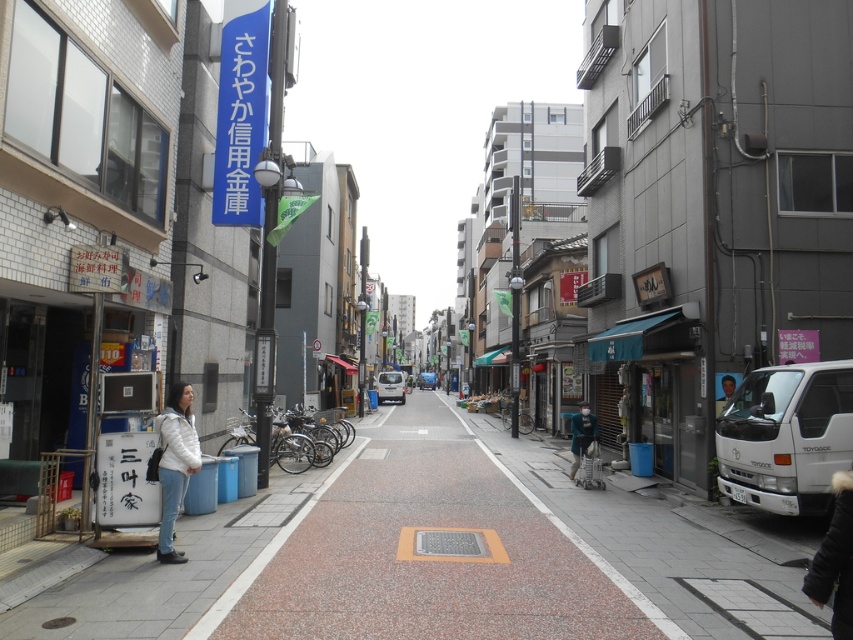
Which of these two, blue fabric awning at lower right or teal fabric jacket at center, stands taller?

blue fabric awning at lower right

Which is behind, point (635, 368) or point (579, 449)?

Point (635, 368)

This screenshot has width=853, height=640. Find the location of `blue fabric awning at lower right`. blue fabric awning at lower right is located at coordinates (659, 387).

Who is more distant from viewer, (173, 492) or (299, 467)?

Point (299, 467)

Is white matte jacket at lower left positioned behind metallic silver bicycles at center?

No, white matte jacket at lower left is in front of metallic silver bicycles at center.

Locate an element on the screen. This screenshot has height=640, width=853. white matte jacket at lower left is located at coordinates (175, 464).

Between point (306, 440) and point (581, 401), which one is positioned in front?

Point (306, 440) is more forward.

Is metallic silver bicycles at center taller than teal fabric jacket at center?

In fact, metallic silver bicycles at center may be shorter than teal fabric jacket at center.

You are a GUI agent. You are given a task and a screenshot of the screen. Output one action in this format:
    pyautogui.click(x=<x>, y=<y>)
    Task: Click on the metallic silver bicycles at center
    The image size is (853, 640).
    Given the screenshot: What is the action you would take?
    pyautogui.click(x=289, y=448)